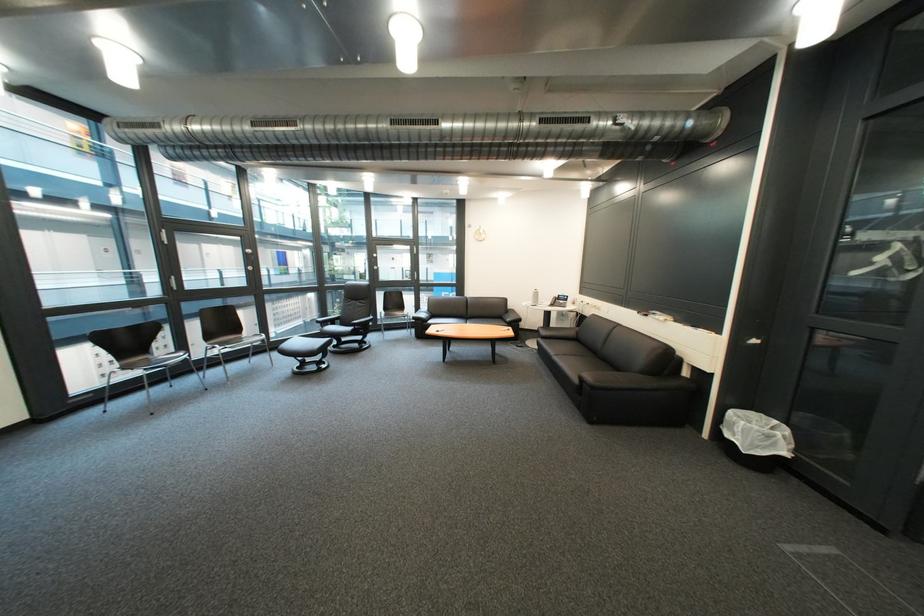
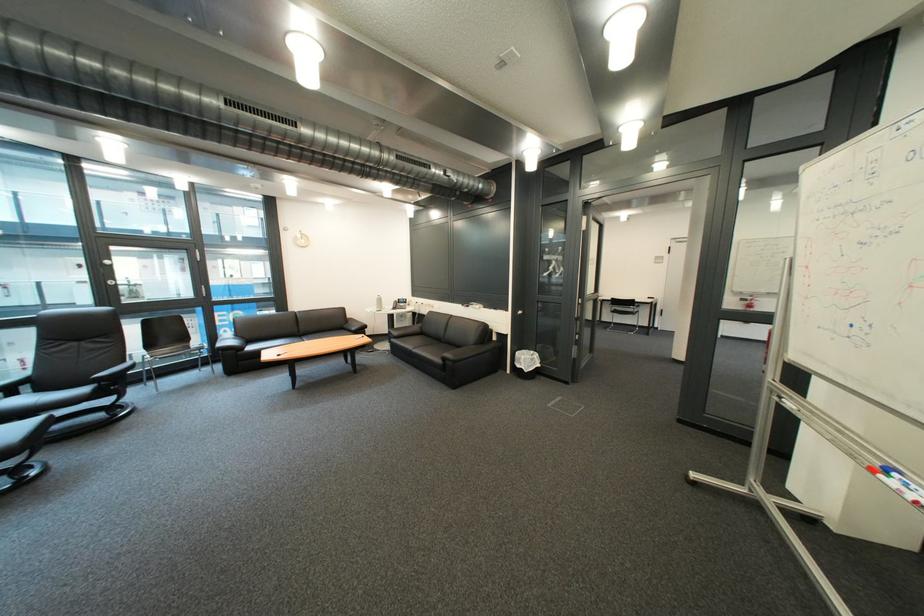
Question: The camera is either moving clockwise (left) or counter-clockwise (right) around the object. The first image is from the beginning of the video and the second image is from the end. Is the camera moving left or right when shooting the video?

Choices:
 (A) Left
 (B) Right

Answer: (A)